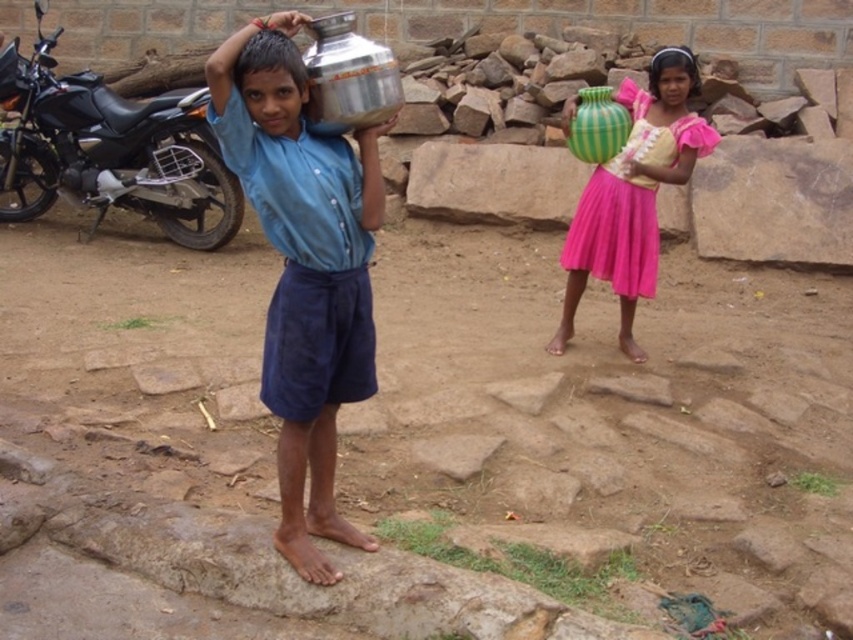
Does point (230, 92) come in front of point (619, 211)?

Yes, it is.

How much distance is there between shiny metallic pot at center and green striped vase at center?

shiny metallic pot at center is 8.31 feet away from green striped vase at center.

Is point (329, 416) positioned in front of point (601, 188)?

Yes, it is.

At what (x,y) coordinates should I click in order to perform the action: click on shiny metallic pot at center. Please return your answer as a coordinate pair (x, y). Image resolution: width=853 pixels, height=640 pixels. Looking at the image, I should click on (303, 268).

What do you see at coordinates (109, 148) in the screenshot?
I see `black metallic motorcycle at left` at bounding box center [109, 148].

Who is higher up, black metallic motorcycle at left or metallic silver water container at upper center?

black metallic motorcycle at left

In order to click on black metallic motorcycle at left in this screenshot , I will do `click(109, 148)`.

The image size is (853, 640). Identify the location of black metallic motorcycle at left. click(109, 148).

Who is higher up, shiny metallic pot at center or metallic silver water container at upper center?

metallic silver water container at upper center

Can you confirm if shiny metallic pot at center is positioned above metallic silver water container at upper center?

No.

At what (x,y) coordinates should I click in order to perform the action: click on shiny metallic pot at center. Please return your answer as a coordinate pair (x, y). The width and height of the screenshot is (853, 640). Looking at the image, I should click on (303, 268).